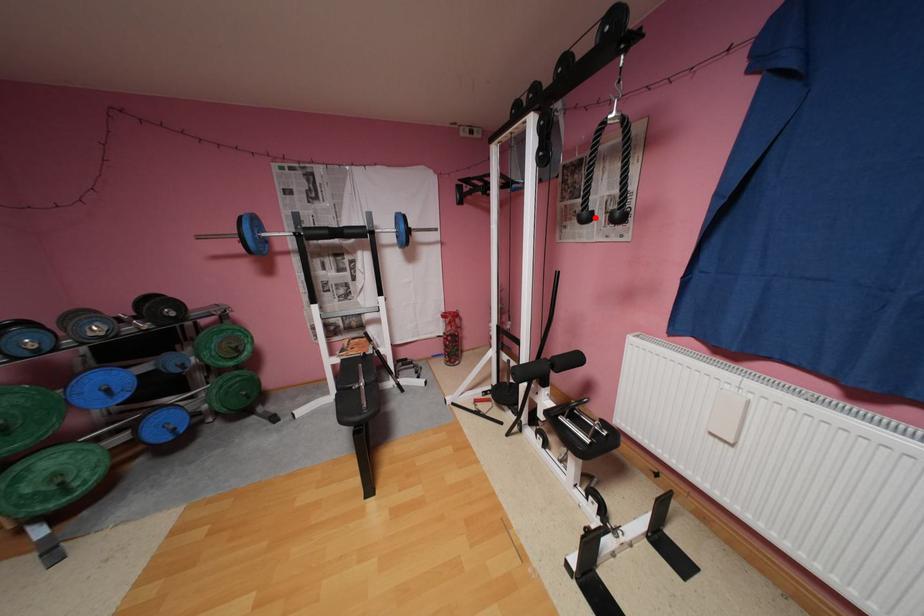
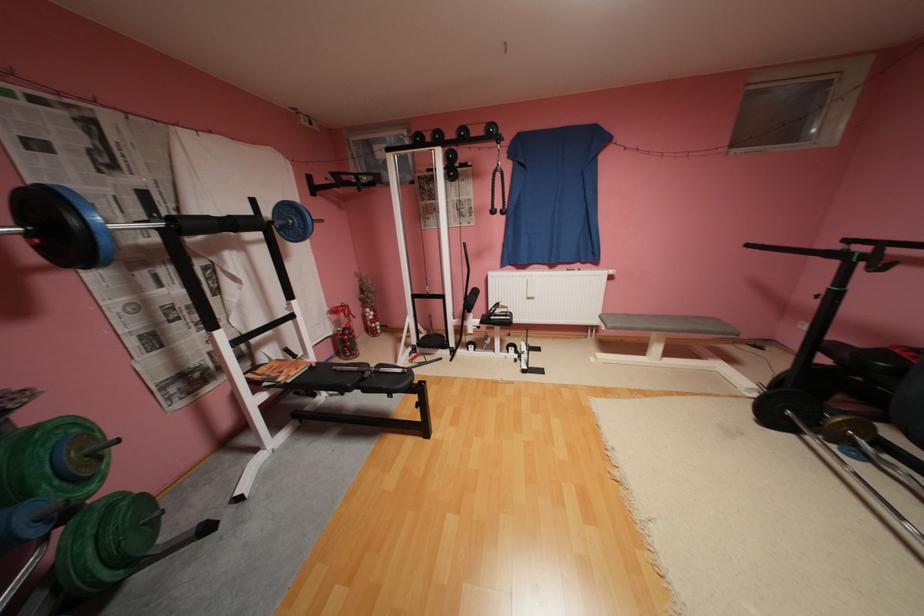
Find the pixel in the second image that matches the highlighted location in the first image.

(502, 212)